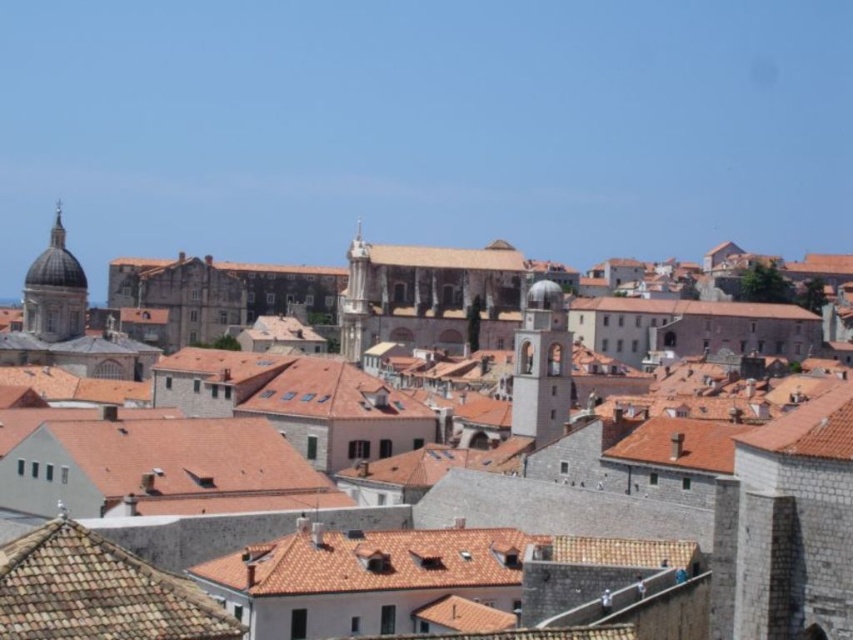
Measure the distance from matte gray dome at upper left to brown tile roof at center.

matte gray dome at upper left and brown tile roof at center are 82.03 meters apart from each other.

Can you confirm if matte gray dome at upper left is smaller than brown tile roof at center?

Yes.

The image size is (853, 640). Describe the element at coordinates (54, 291) in the screenshot. I see `matte gray dome at upper left` at that location.

Identify the location of matte gray dome at upper left. (54, 291).

Is point (93, 577) more distant than point (184, 582)?

No, (93, 577) is closer to viewer.

Who is positioned more to the left, matte stone town at center or brown tile roof at lower left?

Positioned to the left is matte stone town at center.

Locate an element on the screen. matte stone town at center is located at coordinates [421, 531].

Can you confirm if smooth stone bell tower at center is taller than matte gray dome at upper left?

No.

Which is in front, point (563, 304) or point (53, 316)?

Positioned in front is point (563, 304).

What are the coordinates of `smooth stone bell tower at center` in the screenshot? It's located at (541, 365).